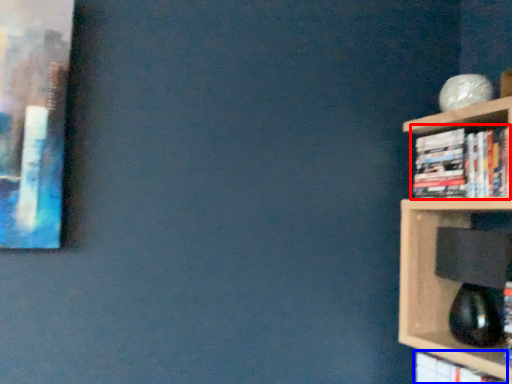
Question: Which of the following is the farthest to the observer, book (highlighted by a red box) or book (highlighted by a blue box)?

Choices:
 (A) book
 (B) book

Answer: (A)